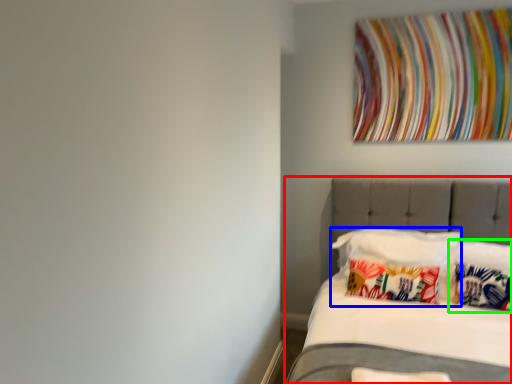
Question: Considering the real-world distances, which object is closest to bed (highlighted by a red box)? pillow (highlighted by a blue box) or pillow (highlighted by a green box).

Choices:
 (A) pillow
 (B) pillow

Answer: (A)